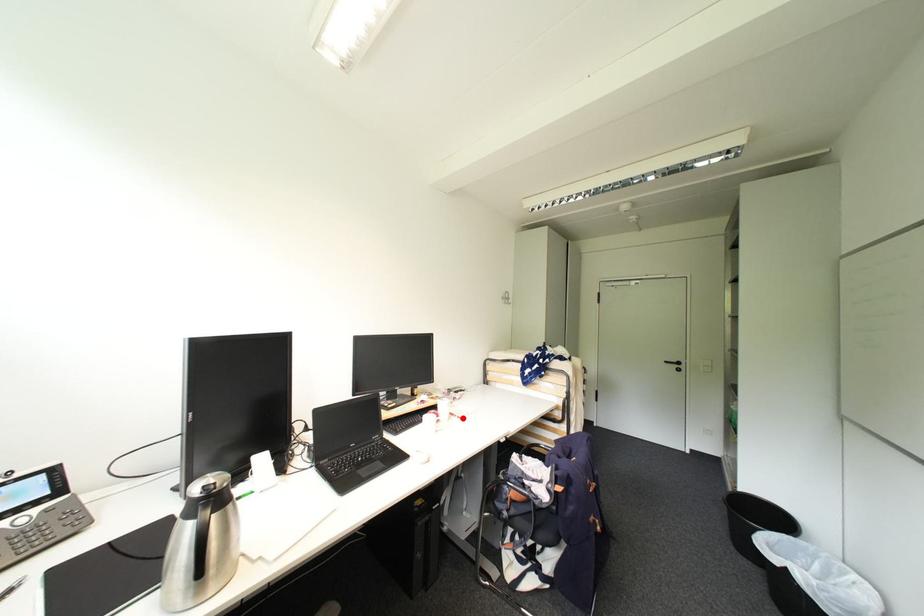
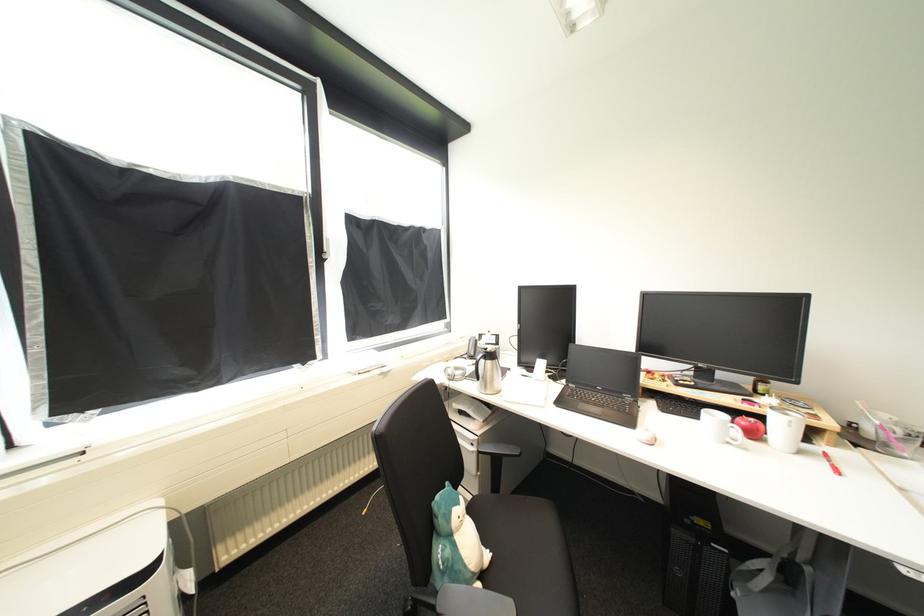
Find the pixel in the second image that matches the highlighted location in the first image.

(834, 464)